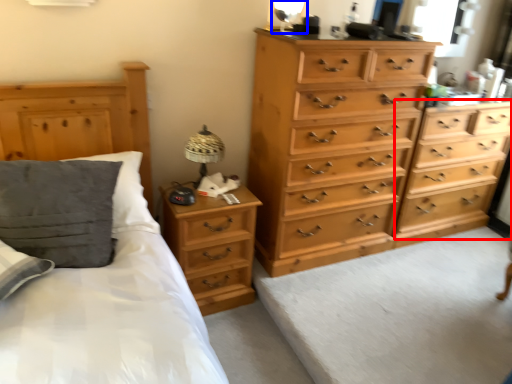
Question: Which object appears farthest to the camera in this image, chest of drawers (highlighted by a red box) or table lamp (highlighted by a blue box)?

Choices:
 (A) chest of drawers
 (B) table lamp

Answer: (A)